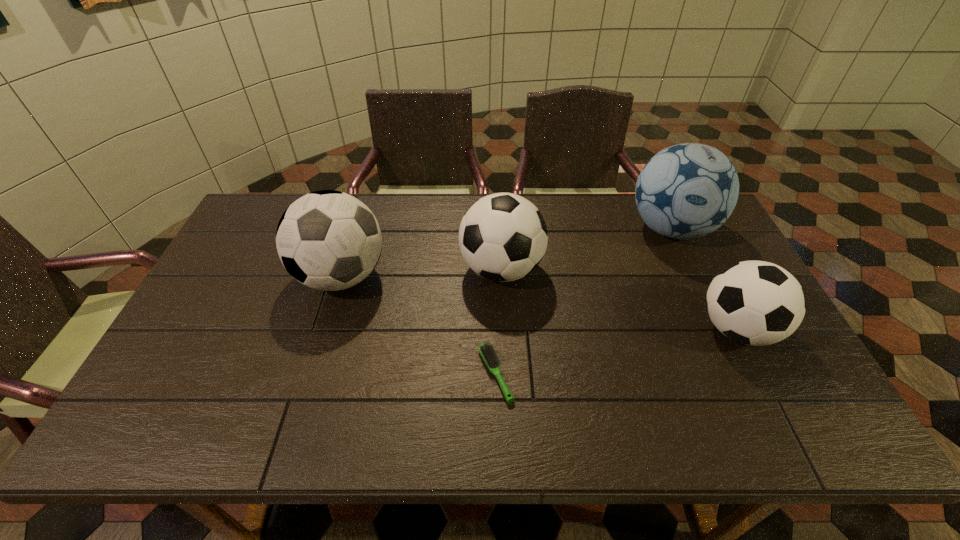
Locate an element on the screen. the leftmost object is located at coordinates (327, 240).

Find the location of a particular element. the second soccer ball from left to right is located at coordinates (503, 237).

Where is `the fourth tallest object`? This screenshot has height=540, width=960. the fourth tallest object is located at coordinates (758, 303).

Find the location of a particular element. the shortest object is located at coordinates (486, 350).

This screenshot has width=960, height=540. In order to click on vacant space located on the main logo of the leftmost soccer ball in this screenshot , I will do `click(297, 425)`.

You are a GUI agent. You are given a task and a screenshot of the screen. Output one action in this format:
    pyautogui.click(x=<x>, y=<y>)
    Task: Click on the vacant region located on the back of the third soccer ball from right to left
    This screenshot has width=960, height=540.
    Given the screenshot: What is the action you would take?
    pyautogui.click(x=498, y=201)

Identify the location of free space located on the left of the fourth tallest object. The width and height of the screenshot is (960, 540). (674, 329).

Where is `free spot located on the right of the hairbrush`? The image size is (960, 540). free spot located on the right of the hairbrush is located at coordinates (635, 374).

Image resolution: width=960 pixels, height=540 pixels. Find the location of `object that is at the far edge`. object that is at the far edge is located at coordinates (686, 191).

Identify the location of object that is at the far right corner. The height and width of the screenshot is (540, 960). (686, 191).